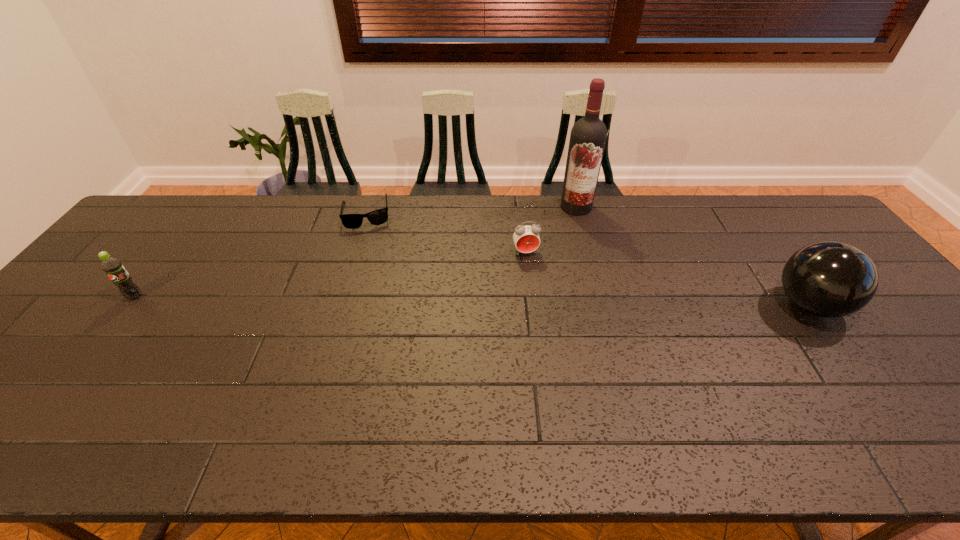
Identify the location of the leftmost object. The image size is (960, 540). (114, 269).

Locate an element on the screen. soda is located at coordinates (114, 269).

Identify the location of the rightmost object. The width and height of the screenshot is (960, 540). pyautogui.click(x=830, y=279).

I want to click on the fourth shortest object, so click(x=830, y=279).

Locate an element on the screen. This screenshot has height=540, width=960. the tallest object is located at coordinates (588, 136).

Where is `the fourth object from left to right`? The height and width of the screenshot is (540, 960). the fourth object from left to right is located at coordinates (588, 136).

The height and width of the screenshot is (540, 960). Identify the location of the fourth object from right to left. (351, 221).

Image resolution: width=960 pixels, height=540 pixels. I want to click on the shortest object, so click(351, 221).

Where is `alarm clock`? alarm clock is located at coordinates (526, 238).

The image size is (960, 540). What are the coordinates of `the second shortest object` in the screenshot? It's located at (526, 238).